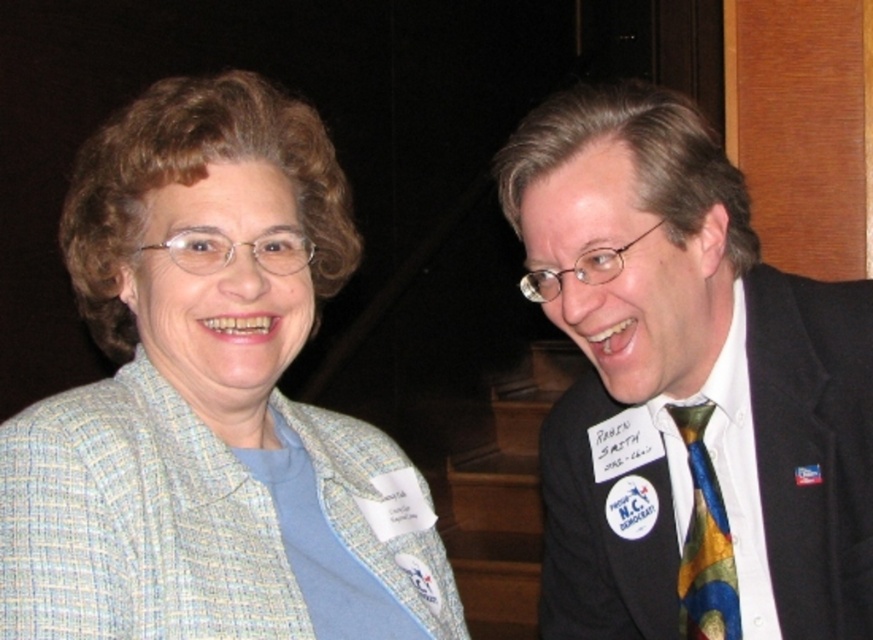
Who is positioned more to the right, multicolored tie at right or multicolored silk tie at right?

From the viewer's perspective, multicolored silk tie at right appears more on the right side.

Is multicolored tie at right below multicolored silk tie at right?

No, multicolored tie at right is not below multicolored silk tie at right.

Is point (675, 150) less distant than point (699, 564)?

Yes.

Locate an element on the screen. The width and height of the screenshot is (873, 640). multicolored tie at right is located at coordinates (686, 378).